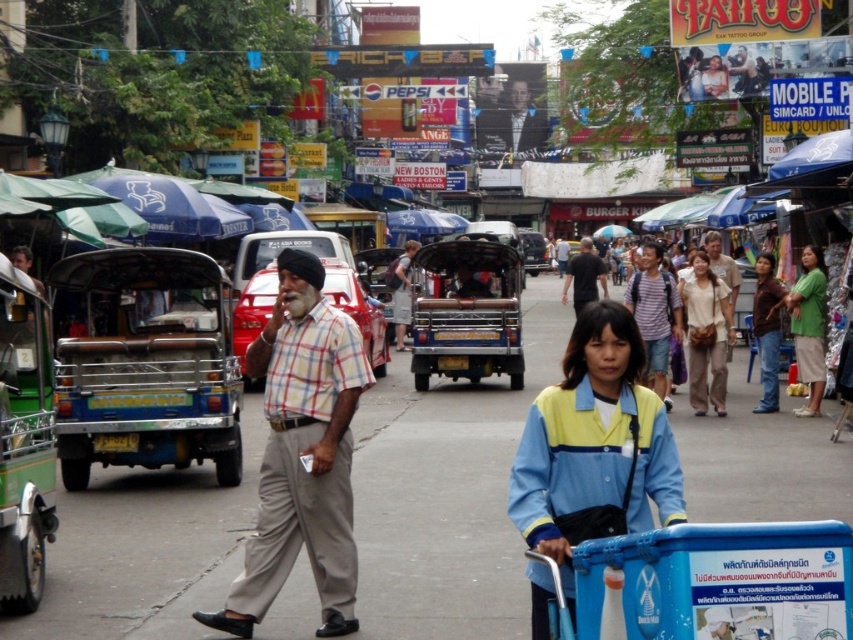
You are a delivery person trying to navigate through the busy street. You see a blue plastic cart at center and light beige fabric pants at center. Which object is shorter in height?

The blue plastic cart at center is not as tall as the light beige fabric pants at center, so the blue plastic cart at center is shorter in height.

From the picture: You are standing on the street and want to take a photo of both the point at coordinates (299,417) and the point at coordinates (508,308). Which point should you focus on first to ensure both are in clear view?

You should focus on point (299,417) first because it is closer to you than point (508,308), ensuring both points are in clear view when focusing on the closer one first.